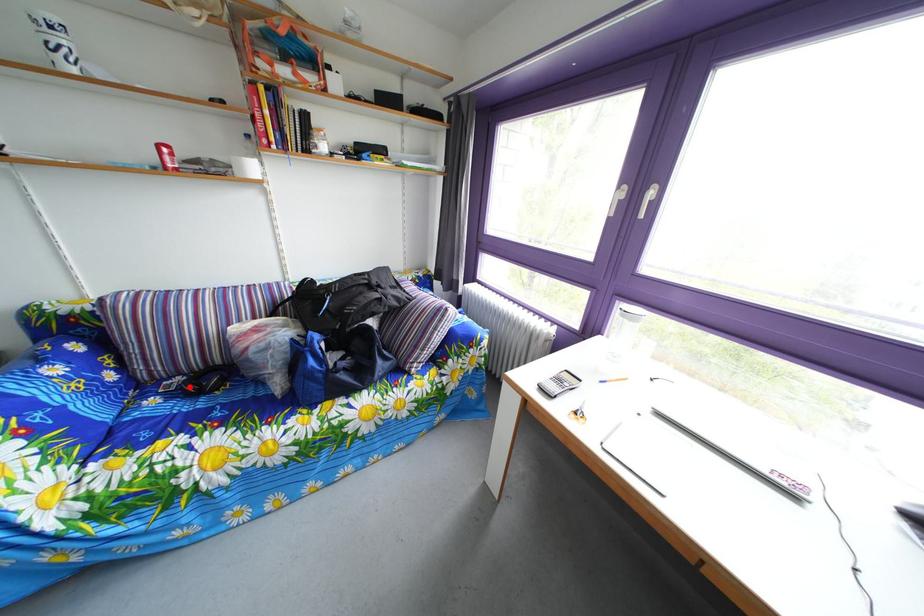
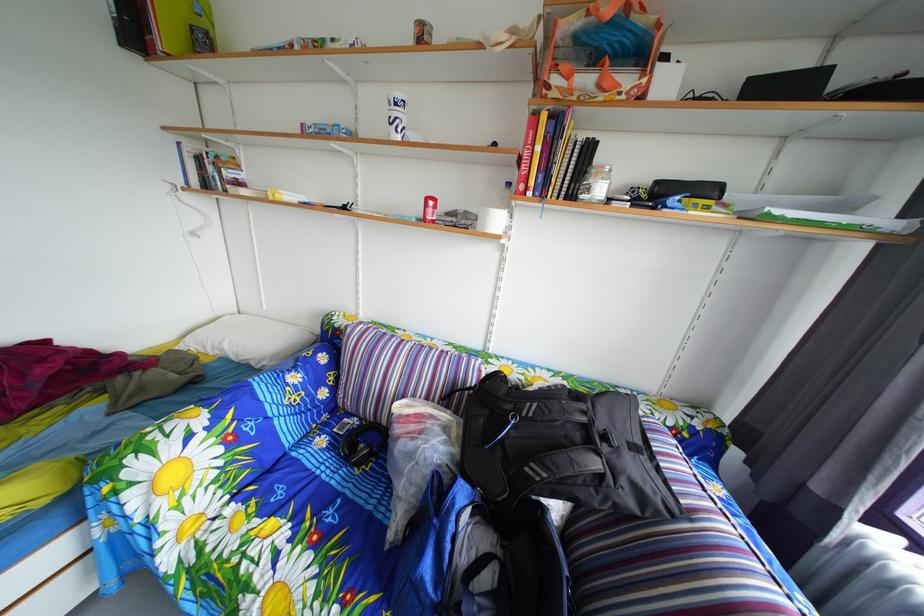
The point at the highlighted location is marked in the first image. Where is the corresponding point in the second image?

(367, 428)